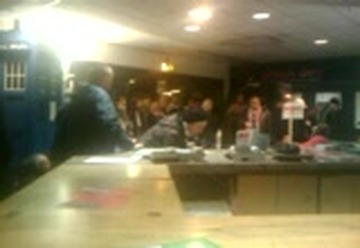
The image size is (360, 248). In order to click on back wall in this screenshot , I will do [334, 71].